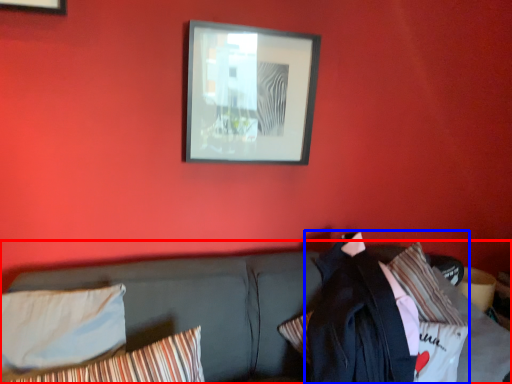
Question: Which object is closer to the camera taking this photo, studio couch (highlighted by a red box) or jacket (highlighted by a blue box)?

Choices:
 (A) studio couch
 (B) jacket

Answer: (A)